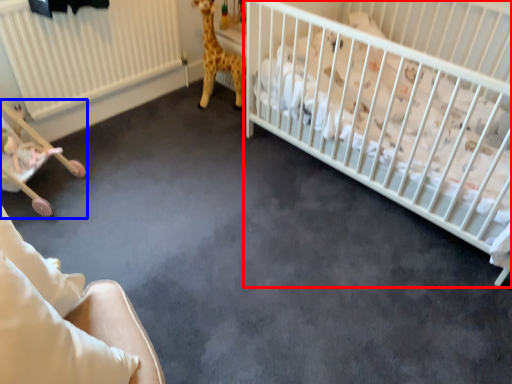
Question: Which of the following is the farthest to the observer, infant bed (highlighted by a red box) or baby carriage (highlighted by a blue box)?

Choices:
 (A) infant bed
 (B) baby carriage

Answer: (B)